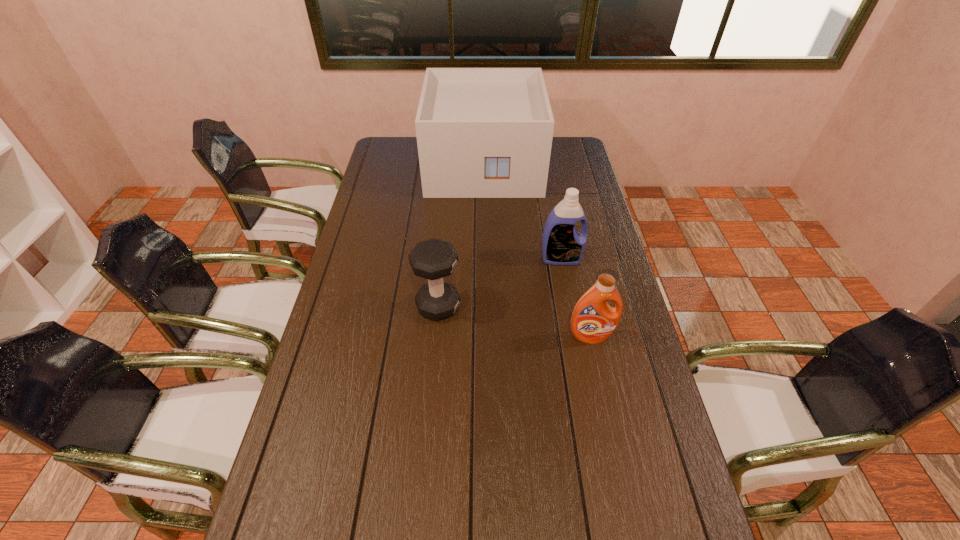
Find the location of a particular element. box is located at coordinates 481,132.

Where is `the farther detergent`? The image size is (960, 540). the farther detergent is located at coordinates (562, 244).

I want to click on the nearest object, so click(x=593, y=321).

Find the location of a particular element. the second nearest object is located at coordinates 433,259.

At what (x,y) coordinates should I click in order to perform the action: click on blank space located 0.370m on the side of the box with the window. Please return your answer as a coordinate pair (x, y). Looking at the image, I should click on (485, 262).

Find the location of a particular element. vacant space positioned on the front of the farther detergent is located at coordinates (574, 330).

Image resolution: width=960 pixels, height=540 pixels. I want to click on vacant region located on the front-facing side of the nearest object, so click(604, 400).

Identify the location of vacant space located on the left of the dumbbell. The height and width of the screenshot is (540, 960). (372, 306).

At what (x,y) coordinates should I click in order to perform the action: click on object located in the far edge section of the desktop. Please return your answer as a coordinate pair (x, y). Looking at the image, I should click on (481, 132).

Where is `free space at the left edge of the desktop`? The width and height of the screenshot is (960, 540). free space at the left edge of the desktop is located at coordinates (329, 368).